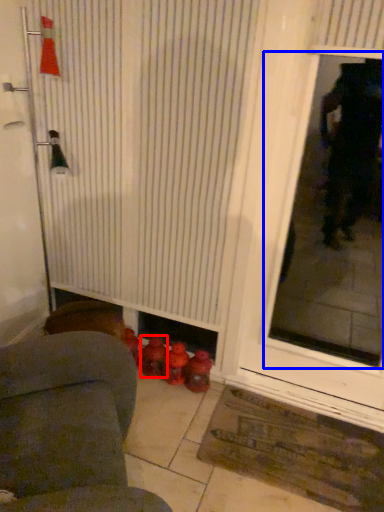
Question: Which object appears farthest to the camera in this image, toy (highlighted by a red box) or window screen (highlighted by a blue box)?

Choices:
 (A) toy
 (B) window screen

Answer: (A)